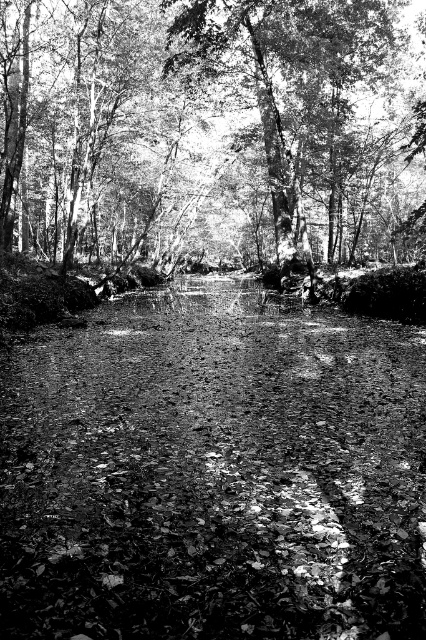
Can you confirm if smooth dirt path at center is positioned below smooth bark tree at center?

Indeed, smooth dirt path at center is positioned under smooth bark tree at center.

Can you confirm if smooth dirt path at center is wider than smooth bark tree at center?

Incorrect, smooth dirt path at center's width does not surpass smooth bark tree at center's.

Which is in front, point (66, 387) or point (77, 182)?

Point (66, 387) is in front.

Identify the location of smooth dirt path at center. Image resolution: width=426 pixels, height=640 pixels. (213, 474).